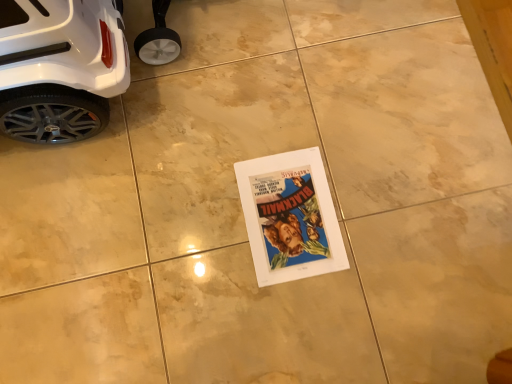
Identify the location of free space that is to the left of vibrant paper movie poster at center. (192, 219).